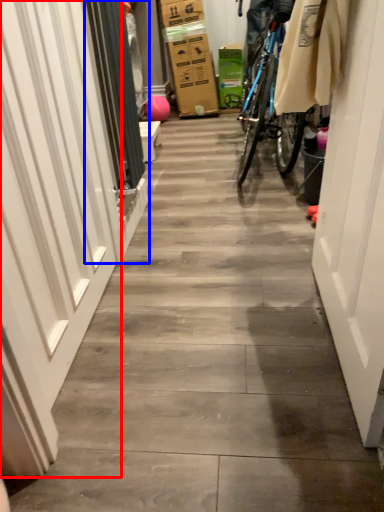
Question: Which object appears closest to the camera in this image, garage door (highlighted by a red box) or screen door (highlighted by a blue box)?

Choices:
 (A) garage door
 (B) screen door

Answer: (A)